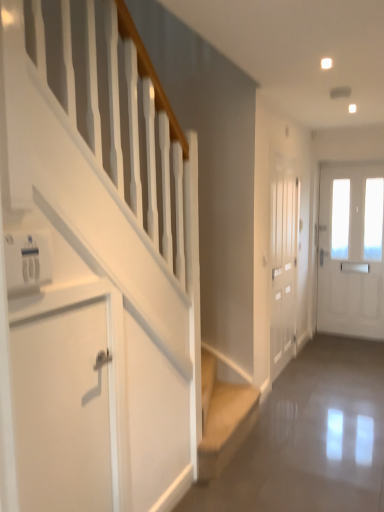
You are a GUI agent. You are given a task and a screenshot of the screen. Output one action in this format:
    pyautogui.click(x=<x>, y=<y>)
    Task: Click on the blank space situated above beige fabric stairs at lower center (from a real-world perspective)
    The height and width of the screenshot is (512, 384).
    Given the screenshot: What is the action you would take?
    pyautogui.click(x=223, y=404)